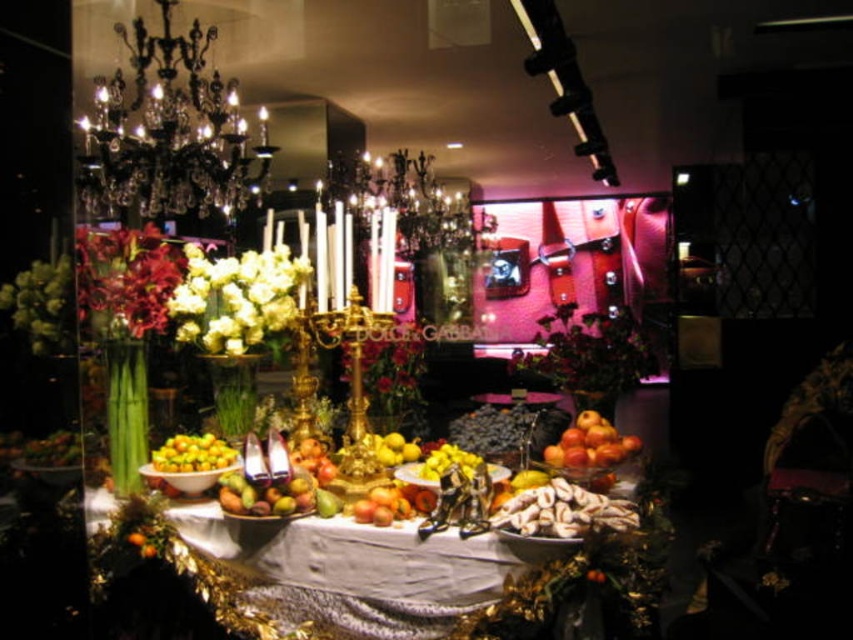
Question: Among these points, which one is nearest to the camera?

Choices:
 (A) (152, 234)
 (B) (172, 44)

Answer: (A)

Question: Based on their relative distances, which object is farther from the yellow matte lemons at center?

Choices:
 (A) black crystal chandelier at upper left
 (B) shiny red apples at center
 (C) shiny metallic table at center
 (D) shiny golden mangoes at center

Answer: (A)

Question: Which of these objects is positioned farthest from the shiny red apples at center?

Choices:
 (A) shiny metallic table at center
 (B) shiny golden mangoes at center
 (C) yellow matte pear at center

Answer: (B)

Question: Can you confirm if shiny red petals at left is positioned below shiny golden mangoes at center?

Choices:
 (A) yes
 (B) no

Answer: (B)

Question: Can you confirm if black crystal chandelier at upper left is positioned to the left of shiny golden mangoes at center?

Choices:
 (A) yes
 (B) no

Answer: (A)

Question: Can you confirm if shiny red petals at left is bigger than shiny golden mangoes at center?

Choices:
 (A) no
 (B) yes

Answer: (B)